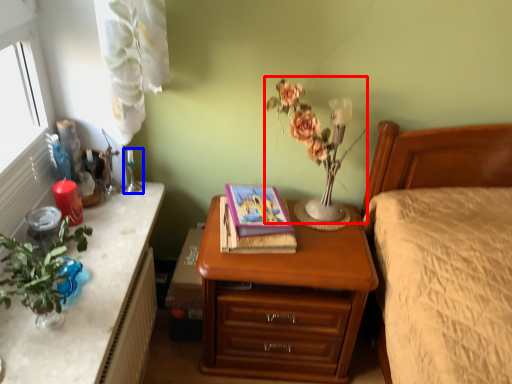
Question: Which object is further to the camera taking this photo, floral arrangement (highlighted by a red box) or candle holder (highlighted by a blue box)?

Choices:
 (A) floral arrangement
 (B) candle holder

Answer: (B)